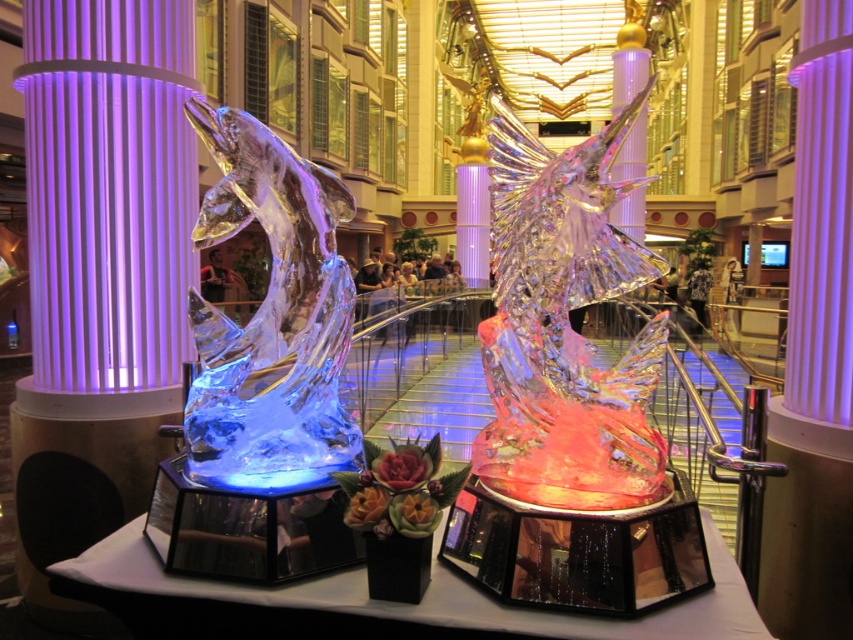
What is the color of the object at point [100,269]?

The object at point [100,269] is a purple translucent pillar.

You are an event planner arranging decorations for a gala. You need to place a 1.2 meter wide decorative panel between the purple translucent pillar at left and the transparent ice fish at center. Based on the provided scene description, will the panel fit between them?

The purple translucent pillar at left is wider than the transparent ice fish at center. However, the exact distance between them isn not specified in the provided information. Without knowing the actual spacing between the two objects, it is impossible to determine if the 1.2 meter wide panel will fit. Additional measurements are needed to confirm.